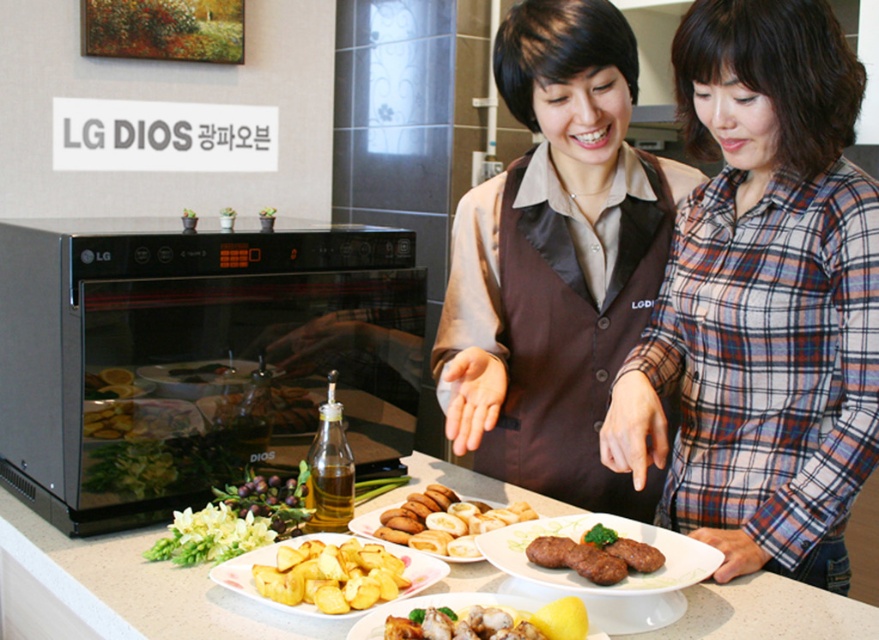
You are a chef standing in the kitchen and want to place a new dish exactly at the center of the table. The table has a white glossy plate at center. Where should you place the new dish?

The white glossy plate at center is located at point (618, 536), so you should place the new dish at that coordinate to ensure it is at the center of the table.

You are a chef preparing a dish and need to place both the white marble counter top at center and the golden brown dough at center on a table. Which object requires more horizontal space?

The white marble counter top at center requires more horizontal space since its width surpasses that of the golden brown dough at center.

You are a chef standing in the kitchen and see the brown fabric vest at center and the shiny black plate at center. Which item is positioned higher up in the scene?

The brown fabric vest at center is above the shiny black plate at center, so it is positioned higher up in the scene.